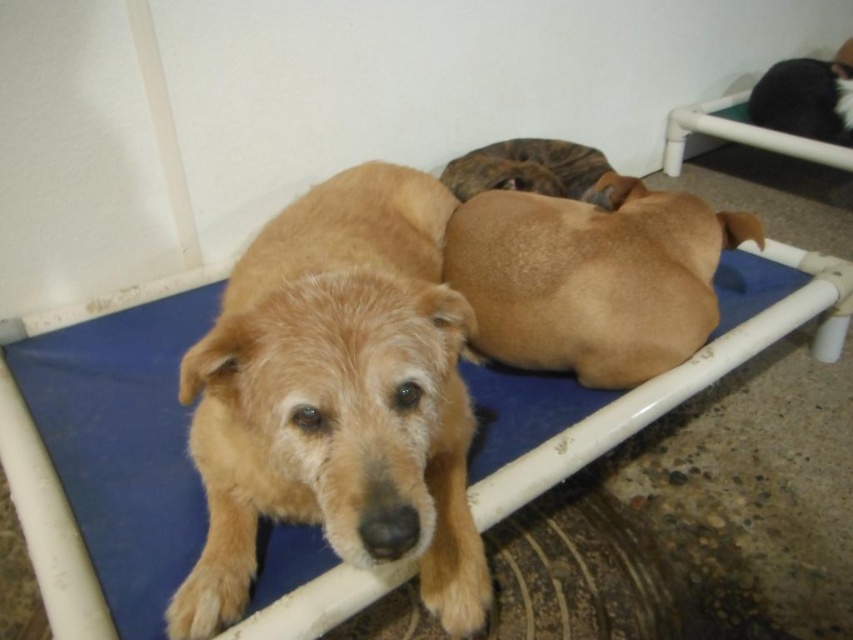
Question: Which of these objects is positioned farthest from the golden fur dog at center?

Choices:
 (A) brown fur dog at center
 (B) brown matte dog at center

Answer: (A)

Question: Considering the relative positions of golden fur dog at center and brown fur dog at center in the image provided, where is golden fur dog at center located with respect to brown fur dog at center?

Choices:
 (A) above
 (B) below

Answer: (B)

Question: Can you confirm if golden fur dog at center is bigger than brown fur dog at center?

Choices:
 (A) yes
 (B) no

Answer: (A)

Question: Which object is farther from the camera taking this photo?

Choices:
 (A) golden fur dog at center
 (B) blue fabric dog bed at center

Answer: (B)

Question: Estimate the real-world distances between objects in this image. Which object is farther from the brown fur dog at center?

Choices:
 (A) golden fur dog at center
 (B) blue fabric dog bed at center
 (C) brown matte dog at center

Answer: (A)

Question: Does golden fur dog at center have a lesser width compared to brown matte dog at center?

Choices:
 (A) yes
 (B) no

Answer: (A)